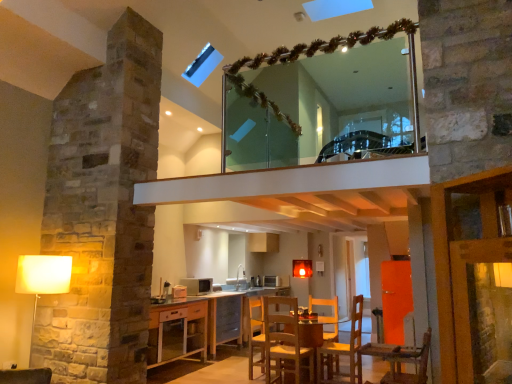
Question: From a real-world perspective, is wooden glass table at center below matte silver microwave at center, which is the second appliance in back-to-front order?

Choices:
 (A) yes
 (B) no

Answer: (A)

Question: Can you confirm if wooden glass table at center is taller than matte silver microwave at center, arranged as the second appliance when viewed from the right?

Choices:
 (A) no
 (B) yes

Answer: (B)

Question: Is wooden glass table at center oriented away from matte silver microwave at center, the first appliance in the top-to-bottom sequence?

Choices:
 (A) no
 (B) yes

Answer: (A)

Question: Is the depth of wooden glass table at center less than that of matte silver microwave at center, the first appliance in the top-to-bottom sequence?

Choices:
 (A) no
 (B) yes

Answer: (B)

Question: Can you confirm if wooden glass table at center is bigger than matte silver microwave at center, which is the second appliance in back-to-front order?

Choices:
 (A) no
 (B) yes

Answer: (B)

Question: Is wooden glass table at center wider or thinner than wooden chair at lower right?

Choices:
 (A) thin
 (B) wide

Answer: (B)

Question: Is wooden glass table at center bigger or smaller than wooden chair at lower right?

Choices:
 (A) small
 (B) big

Answer: (B)

Question: Does point (311, 324) appear closer or farther from the camera than point (425, 374)?

Choices:
 (A) farther
 (B) closer

Answer: (A)

Question: Considering the relative positions of wooden glass table at center and wooden chair at lower right in the image provided, is wooden glass table at center to the left or to the right of wooden chair at lower right?

Choices:
 (A) right
 (B) left

Answer: (B)

Question: From a real-world perspective, is wooden chair at lower center physically located above or below wooden chair at lower right?

Choices:
 (A) above
 (B) below

Answer: (B)

Question: Looking at the image, does wooden chair at lower center seem bigger or smaller compared to wooden chair at lower right?

Choices:
 (A) small
 (B) big

Answer: (B)

Question: Based on their positions, is wooden chair at lower center located to the left or right of wooden chair at lower right?

Choices:
 (A) right
 (B) left

Answer: (B)

Question: Is wooden chair at lower center in front of or behind wooden chair at lower right in the image?

Choices:
 (A) behind
 (B) front

Answer: (A)

Question: Which is correct: matte white lampshade at left is inside wooden glass table at center, or outside of it?

Choices:
 (A) inside
 (B) outside

Answer: (B)

Question: In terms of width, does matte white lampshade at left look wider or thinner when compared to wooden glass table at center?

Choices:
 (A) wide
 (B) thin

Answer: (B)